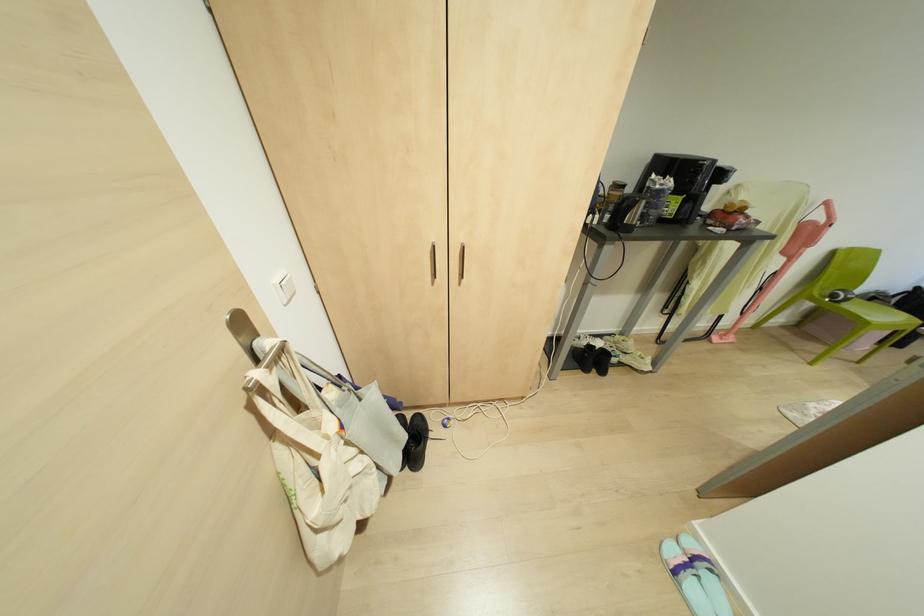
You are a GUI agent. You are given a task and a screenshot of the screen. Output one action in this format:
    pyautogui.click(x=<x>, y=<y>)
    Task: Click on the silver door hanger
    The height and width of the screenshot is (616, 924).
    Given the screenshot: What is the action you would take?
    pyautogui.click(x=272, y=346)